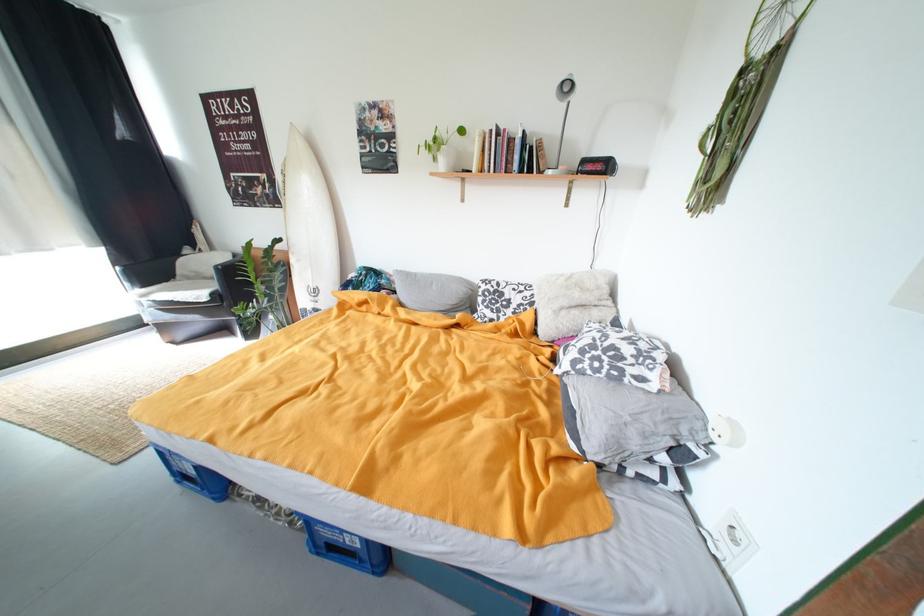
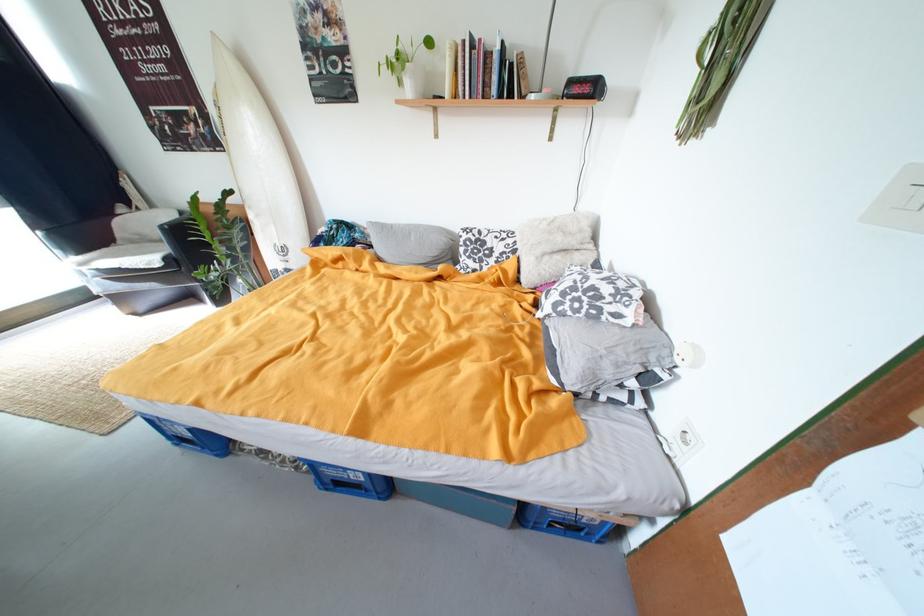
Where in the second image is the point corresponding to the point at 708,426 from the first image?

(675, 353)